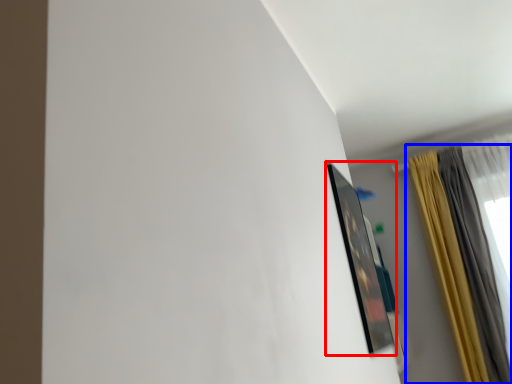
Question: Which point is further to the camera, picture frame (highlighted by a red box) or curtain (highlighted by a blue box)?

Choices:
 (A) picture frame
 (B) curtain

Answer: (B)